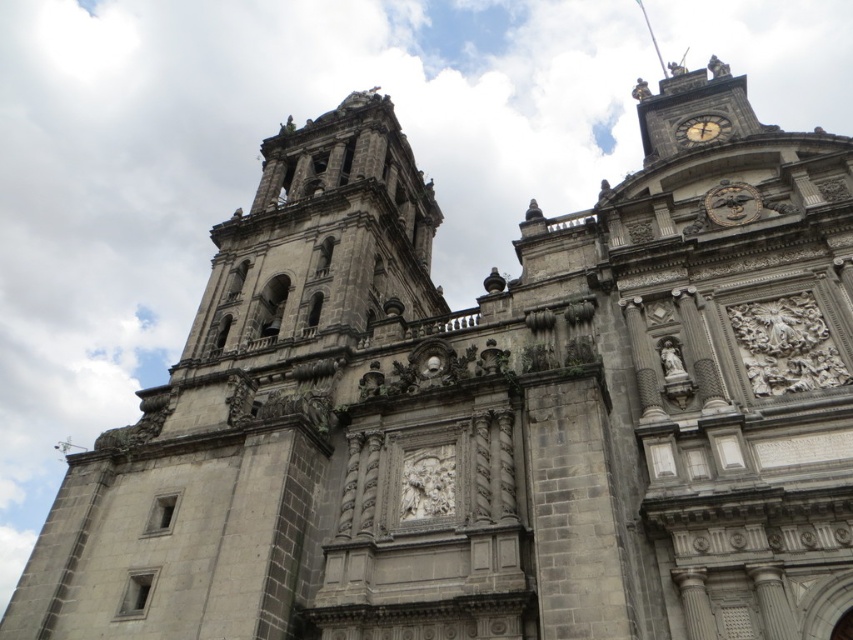
You are standing in front of a historic stone building and want to locate the gold metallic clock at upper center. Based on the coordinates provided, can you determine its position relative to the edges of the image?

The gold metallic clock at upper center is located at coordinates 0.319 on the x axis and 0.859 on the y axis, meaning it is positioned closer to the left edge and near the top of the image.

You are an architect examining the cathedral facade. You notice two clocks on the building. Which clock, the gold metallic clock at upper center or the golden metallic clock at upper right, is located to the left of the other?

The gold metallic clock at upper center is positioned on the left side of the golden metallic clock at upper right.